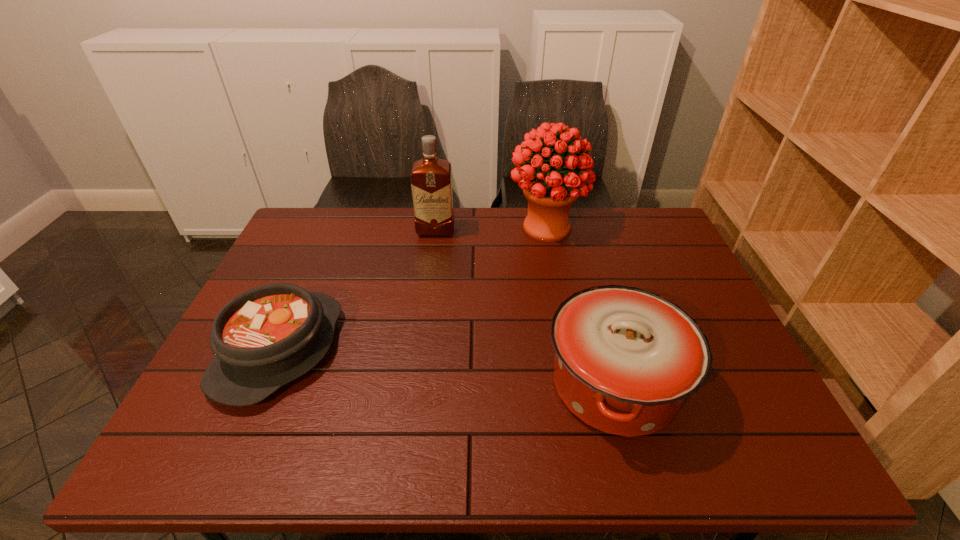
The image size is (960, 540). What are the coordinates of `empty space between the liquor and the bouquet` in the screenshot? It's located at coord(491,230).

Identify the location of vacant point located between the second shortest object and the leftmost object. (446, 367).

Where is `vacant space that is in between the second object from left to right and the bouquet`? The width and height of the screenshot is (960, 540). vacant space that is in between the second object from left to right and the bouquet is located at coordinates (491, 230).

At what (x,y) coordinates should I click in order to perform the action: click on free space that is in between the leftmost object and the bouquet. Please return your answer as a coordinate pair (x, y). The width and height of the screenshot is (960, 540). Looking at the image, I should click on (413, 288).

At what (x,y) coordinates should I click in order to perform the action: click on free space between the shorter casserole and the bouquet. Please return your answer as a coordinate pair (x, y). The height and width of the screenshot is (540, 960). Looking at the image, I should click on (413, 288).

Image resolution: width=960 pixels, height=540 pixels. Find the location of `vacant space that's between the third object from right to left and the taller casserole`. vacant space that's between the third object from right to left and the taller casserole is located at coordinates (525, 308).

The image size is (960, 540). What are the coordinates of `free space between the bouquet and the left casserole` in the screenshot? It's located at (413, 288).

Locate an element on the screen. the second closest object to the liquor is located at coordinates (264, 338).

Locate an element on the screen. Image resolution: width=960 pixels, height=540 pixels. object that stands as the closest to the left casserole is located at coordinates (431, 178).

This screenshot has height=540, width=960. Find the location of `free space that satisfies the following two spatial constraints: 1. on the back side of the bouquet; 2. on the left side of the shorter casserole`. free space that satisfies the following two spatial constraints: 1. on the back side of the bouquet; 2. on the left side of the shorter casserole is located at coordinates click(333, 227).